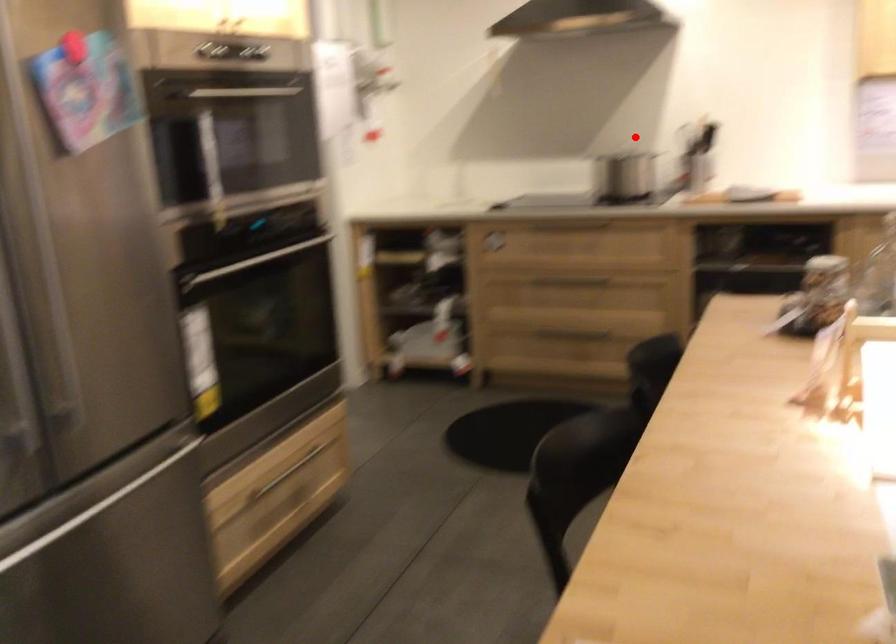
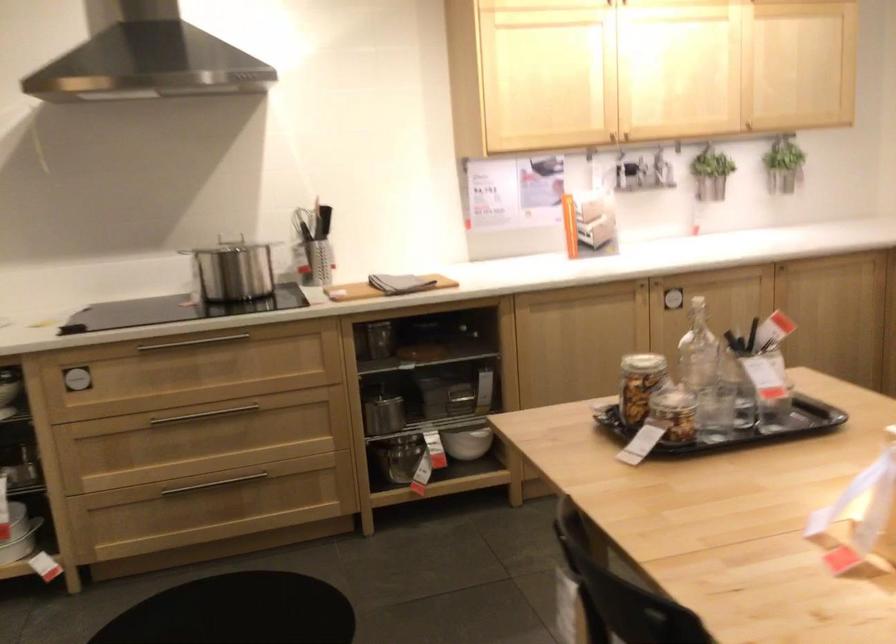
Question: I am providing you with two images of the same scene from different viewpoints. In image1, a red point is highlighted. Considering the same 3D point in image2, which of the following is correct?

Choices:
 (A) It is closer
 (B) It is farther

Answer: (A)